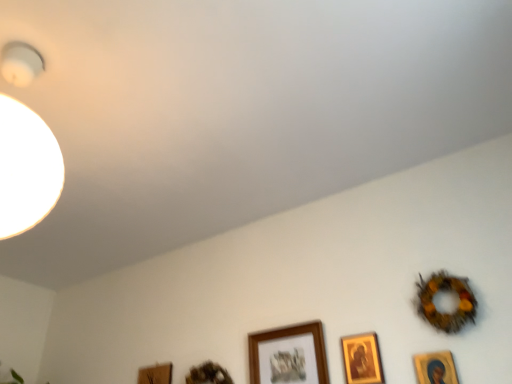
Describe the element at coordinates (435, 368) in the screenshot. The image size is (512, 384). I see `gold-framed picture at lower right, the 1th picture frame from the right` at that location.

You are a GUI agent. You are given a task and a screenshot of the screen. Output one action in this format:
    pyautogui.click(x=<x>, y=<y>)
    Task: Click on the gold-framed picture at lower right, arranged as the 4th picture frame when viewed from the left
    The image size is (512, 384).
    Given the screenshot: What is the action you would take?
    pyautogui.click(x=362, y=358)

Where is `wooden frame at lower center, the 1th picture frame in the left-to-right sequence`? This screenshot has height=384, width=512. wooden frame at lower center, the 1th picture frame in the left-to-right sequence is located at coordinates (155, 374).

Locate an element on the screen. Image resolution: width=512 pixels, height=384 pixels. gold-framed picture at lower right, which is counted as the 5th picture frame, starting from the left is located at coordinates (435, 368).

Is gold-framed picture at lower right, the 1th picture frame from the right, touching gold-framed picture at lower right, arranged as the second picture frame when viewed from the right?

No, gold-framed picture at lower right, the 1th picture frame from the right, is not touching gold-framed picture at lower right, arranged as the second picture frame when viewed from the right.

Is gold-framed picture at lower right, arranged as the second picture frame when viewed from the right, at the back of gold-framed picture at lower right, the 1th picture frame from the right?

No, gold-framed picture at lower right, arranged as the second picture frame when viewed from the right, is not at the back of gold-framed picture at lower right, the 1th picture frame from the right.

Is gold-framed picture at lower right, which is counted as the 5th picture frame, starting from the left, positioned before gold-framed picture at lower right, arranged as the 4th picture frame when viewed from the left?

Yes, gold-framed picture at lower right, which is counted as the 5th picture frame, starting from the left, is closer to the viewer.

Would you say wooden frame at lower center, arranged as the 4th picture frame when viewed from the right, is outside wooden frame at lower center, acting as the third picture frame starting from the left?

Yes, wooden frame at lower center, arranged as the 4th picture frame when viewed from the right, is outside of wooden frame at lower center, acting as the third picture frame starting from the left.

Considering the relative sizes of wooden frame at lower center, arranged as the second picture frame when viewed from the left, and wooden frame at lower center, acting as the third picture frame starting from the left, in the image provided, is wooden frame at lower center, arranged as the second picture frame when viewed from the left, smaller than wooden frame at lower center, acting as the third picture frame starting from the left,?

Correct, wooden frame at lower center, arranged as the second picture frame when viewed from the left, occupies less space than wooden frame at lower center, acting as the third picture frame starting from the left.

At what (x,y) coordinates should I click in order to perform the action: click on the 1st picture frame to the right when counting from the wooden frame at lower center, arranged as the 4th picture frame when viewed from the right. Please return your answer as a coordinate pair (x, y). The height and width of the screenshot is (384, 512). Looking at the image, I should click on (288, 355).

From a real-world perspective, is wooden frame at lower center, arranged as the second picture frame when viewed from the left, positioned above or below wooden frame at lower center, acting as the third picture frame starting from the left?

wooden frame at lower center, arranged as the second picture frame when viewed from the left, is situated higher than wooden frame at lower center, acting as the third picture frame starting from the left, in the real world.

Does point (220, 370) come farther from viewer compared to point (448, 363)?

Yes, point (220, 370) is behind point (448, 363).

Between wooden frame at lower center, arranged as the second picture frame when viewed from the left, and gold-framed picture at lower right, the 1th picture frame from the right, which one is positioned behind?

wooden frame at lower center, arranged as the second picture frame when viewed from the left, is further from the camera.

Is wooden frame at lower center, arranged as the 4th picture frame when viewed from the right, placed right next to gold-framed picture at lower right, the 1th picture frame from the right?

wooden frame at lower center, arranged as the 4th picture frame when viewed from the right, and gold-framed picture at lower right, the 1th picture frame from the right, are clearly separated.

Considering the relative positions of wooden frame at lower center, arranged as the second picture frame when viewed from the left, and gold-framed picture at lower right, the 1th picture frame from the right, in the image provided, is wooden frame at lower center, arranged as the second picture frame when viewed from the left, to the right of gold-framed picture at lower right, the 1th picture frame from the right, from the viewer's perspective?

In fact, wooden frame at lower center, arranged as the second picture frame when viewed from the left, is to the left of gold-framed picture at lower right, the 1th picture frame from the right.

Does point (323, 351) come closer to viewer compared to point (377, 381)?

No, (323, 351) is further to viewer.

Who is taller, wooden frame at lower center, arranged as the 3th picture frame when viewed from the right, or gold-framed picture at lower right, arranged as the second picture frame when viewed from the right?

Standing taller between the two is wooden frame at lower center, arranged as the 3th picture frame when viewed from the right.

Is wooden frame at lower center, arranged as the 3th picture frame when viewed from the right, beside gold-framed picture at lower right, arranged as the second picture frame when viewed from the right?

No, wooden frame at lower center, arranged as the 3th picture frame when viewed from the right, is not in contact with gold-framed picture at lower right, arranged as the second picture frame when viewed from the right.

In the scene shown: Is wooden frame at lower center, arranged as the 3th picture frame when viewed from the right, at the right side of gold-framed picture at lower right, arranged as the second picture frame when viewed from the right?

No.

Consider the image. Is wooden frame at lower center, which is the fifth picture frame from right to left, looking in the opposite direction of gold-framed picture at lower right, arranged as the 4th picture frame when viewed from the left?

No, gold-framed picture at lower right, arranged as the 4th picture frame when viewed from the left, is not at the back of wooden frame at lower center, which is the fifth picture frame from right to left.

Is wooden frame at lower center, the 1th picture frame in the left-to-right sequence, with gold-framed picture at lower right, arranged as the second picture frame when viewed from the right?

No, wooden frame at lower center, the 1th picture frame in the left-to-right sequence, is not next to gold-framed picture at lower right, arranged as the second picture frame when viewed from the right.

From the image's perspective, would you say wooden frame at lower center, the 1th picture frame in the left-to-right sequence, is positioned over gold-framed picture at lower right, arranged as the second picture frame when viewed from the right?

Incorrect, from the image's perspective, wooden frame at lower center, the 1th picture frame in the left-to-right sequence, is lower than gold-framed picture at lower right, arranged as the second picture frame when viewed from the right.

Does point (152, 368) come in front of point (351, 353)?

No, it is not.

Is gold-framed picture at lower right, the 1th picture frame from the right, not near wooden frame at lower center, arranged as the second picture frame when viewed from the left?

gold-framed picture at lower right, the 1th picture frame from the right, is near wooden frame at lower center, arranged as the second picture frame when viewed from the left, not far away.

Considering the relative sizes of gold-framed picture at lower right, the 1th picture frame from the right, and wooden frame at lower center, arranged as the 4th picture frame when viewed from the right, in the image provided, is gold-framed picture at lower right, the 1th picture frame from the right, thinner than wooden frame at lower center, arranged as the 4th picture frame when viewed from the right,?

Yes.

In the image, is gold-framed picture at lower right, the 1th picture frame from the right, on the left side or the right side of wooden frame at lower center, arranged as the second picture frame when viewed from the left?

Clearly, gold-framed picture at lower right, the 1th picture frame from the right, is on the right of wooden frame at lower center, arranged as the second picture frame when viewed from the left, in the image.

From the picture: Which is correct: gold-framed picture at lower right, the 1th picture frame from the right, is inside wooden frame at lower center, arranged as the 4th picture frame when viewed from the right, or outside of it?

gold-framed picture at lower right, the 1th picture frame from the right, lies outside wooden frame at lower center, arranged as the 4th picture frame when viewed from the right.

From a real-world perspective, which is physically above, wooden frame at lower center, arranged as the 4th picture frame when viewed from the right, or wooden frame at lower center, the 1th picture frame in the left-to-right sequence?

wooden frame at lower center, arranged as the 4th picture frame when viewed from the right, is physically above.

Between wooden frame at lower center, arranged as the second picture frame when viewed from the left, and wooden frame at lower center, which is the fifth picture frame from right to left, which one appears on the left side from the viewer's perspective?

Positioned to the left is wooden frame at lower center, which is the fifth picture frame from right to left.

Is wooden frame at lower center, arranged as the second picture frame when viewed from the left, thinner than wooden frame at lower center, the 1th picture frame in the left-to-right sequence?

No, wooden frame at lower center, arranged as the second picture frame when viewed from the left, is not thinner than wooden frame at lower center, the 1th picture frame in the left-to-right sequence.

From a real-world perspective, starting from the gold-framed picture at lower right, arranged as the 4th picture frame when viewed from the left, which picture frame is the 2nd one below it? Please provide its 2D coordinates.

[(435, 368)]

Where is `the 1st picture frame to the right of the wooden frame at lower center, arranged as the 4th picture frame when viewed from the right, counting from the anchor's position`? Image resolution: width=512 pixels, height=384 pixels. the 1st picture frame to the right of the wooden frame at lower center, arranged as the 4th picture frame when viewed from the right, counting from the anchor's position is located at coordinates (288, 355).

Looking at the image, which one is located further to wooden frame at lower center, arranged as the 3th picture frame when viewed from the right, gold-framed picture at lower right, which is counted as the 5th picture frame, starting from the left, or wooden frame at lower center, the 1th picture frame in the left-to-right sequence?

Among the two, wooden frame at lower center, the 1th picture frame in the left-to-right sequence, is located further to wooden frame at lower center, arranged as the 3th picture frame when viewed from the right.

Which object lies nearer to the anchor point gold-framed picture at lower right, arranged as the second picture frame when viewed from the right, wooden frame at lower center, arranged as the 4th picture frame when viewed from the right, or gold-framed picture at lower right, which is counted as the 5th picture frame, starting from the left?

gold-framed picture at lower right, which is counted as the 5th picture frame, starting from the left, is positioned closer to the anchor gold-framed picture at lower right, arranged as the second picture frame when viewed from the right.

When comparing their distances from wooden frame at lower center, the 1th picture frame in the left-to-right sequence, does gold-framed picture at lower right, arranged as the second picture frame when viewed from the right, or wooden frame at lower center, arranged as the second picture frame when viewed from the left, seem further?

Based on the image, gold-framed picture at lower right, arranged as the second picture frame when viewed from the right, appears to be further to wooden frame at lower center, the 1th picture frame in the left-to-right sequence.

Considering their positions, is gold-framed picture at lower right, the 1th picture frame from the right, positioned closer to wooden frame at lower center, the 1th picture frame in the left-to-right sequence, than gold-framed picture at lower right, arranged as the second picture frame when viewed from the right?

gold-framed picture at lower right, arranged as the second picture frame when viewed from the right, lies closer to wooden frame at lower center, the 1th picture frame in the left-to-right sequence, than the other object.

From the picture: From the image, which object appears to be nearer to gold-framed picture at lower right, arranged as the second picture frame when viewed from the right, wooden frame at lower center, the 1th picture frame in the left-to-right sequence, or wooden frame at lower center, arranged as the second picture frame when viewed from the left?

wooden frame at lower center, arranged as the second picture frame when viewed from the left, lies closer to gold-framed picture at lower right, arranged as the second picture frame when viewed from the right, than the other object.

Considering their positions, is wooden frame at lower center, arranged as the 4th picture frame when viewed from the right, positioned further to gold-framed picture at lower right, which is counted as the 5th picture frame, starting from the left, than wooden frame at lower center, arranged as the 3th picture frame when viewed from the right?

wooden frame at lower center, arranged as the 4th picture frame when viewed from the right, is further to gold-framed picture at lower right, which is counted as the 5th picture frame, starting from the left.

Looking at the image, which one is located closer to wooden frame at lower center, acting as the third picture frame starting from the left, gold-framed picture at lower right, the 1th picture frame from the right, or wooden frame at lower center, arranged as the 4th picture frame when viewed from the right?

wooden frame at lower center, arranged as the 4th picture frame when viewed from the right, lies closer to wooden frame at lower center, acting as the third picture frame starting from the left, than the other object.

When comparing their distances from wooden frame at lower center, which is the fifth picture frame from right to left, does gold-framed picture at lower right, the 1th picture frame from the right, or wooden frame at lower center, acting as the third picture frame starting from the left, seem closer?

Based on the image, wooden frame at lower center, acting as the third picture frame starting from the left, appears to be nearer to wooden frame at lower center, which is the fifth picture frame from right to left.

The width and height of the screenshot is (512, 384). Identify the location of picture frame situated between wooden frame at lower center, the 1th picture frame in the left-to-right sequence, and wooden frame at lower center, acting as the third picture frame starting from the left, from left to right. (208, 374).

Where is `picture frame between wooden frame at lower center, arranged as the second picture frame when viewed from the left, and gold-framed picture at lower right, arranged as the second picture frame when viewed from the right, from left to right`? The image size is (512, 384). picture frame between wooden frame at lower center, arranged as the second picture frame when viewed from the left, and gold-framed picture at lower right, arranged as the second picture frame when viewed from the right, from left to right is located at coordinates (288, 355).

At what (x,y) coordinates should I click in order to perform the action: click on picture frame between wooden frame at lower center, acting as the third picture frame starting from the left, and gold-framed picture at lower right, which is counted as the 5th picture frame, starting from the left, from left to right. Please return your answer as a coordinate pair (x, y). Image resolution: width=512 pixels, height=384 pixels. Looking at the image, I should click on pos(362,358).